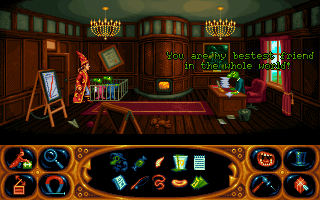
Locate an element on the screen. notepad is located at coordinates (203, 160).